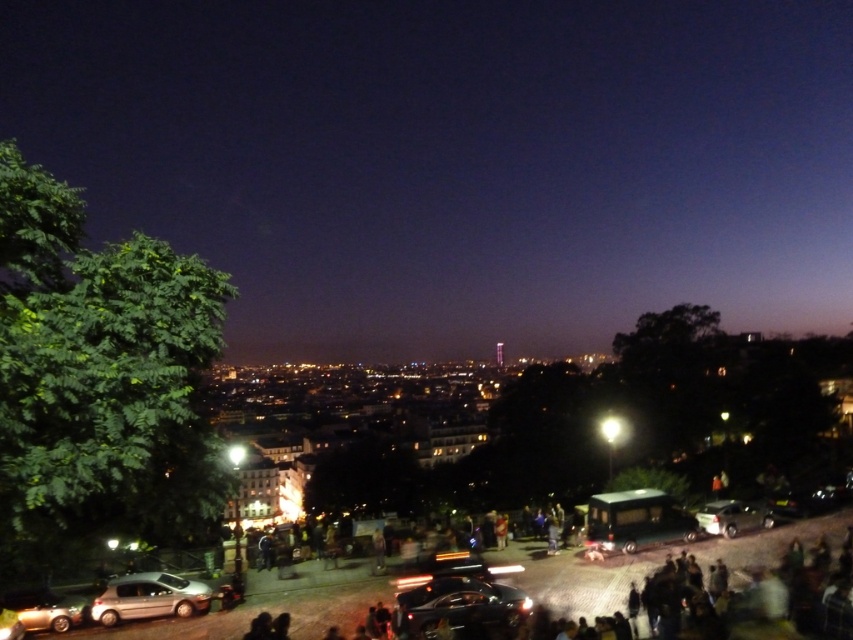
You are a delivery person needing to park your vehicle in the parking spot that can only accommodate cars narrower than 1.8 meters. You see the glossy black car at lower center and the metallic silver car at lower right. Which car can fit into the parking spot?

The metallic silver car at lower right can fit into the parking spot since its width is smaller than 1.8 meters, while the glossy black car at lower center is wider and cannot fit.

You are a delivery person who needs to park your van between the silver metallic hatchback at lower left and the metallic silver car at lower right. Is there enough space between them to park your van?

The silver metallic hatchback at lower left is positioned under the metallic silver car at lower right, which means they are stacked vertically rather than horizontally. Since the van requires horizontal space, there is insufficient space between them to park the van.